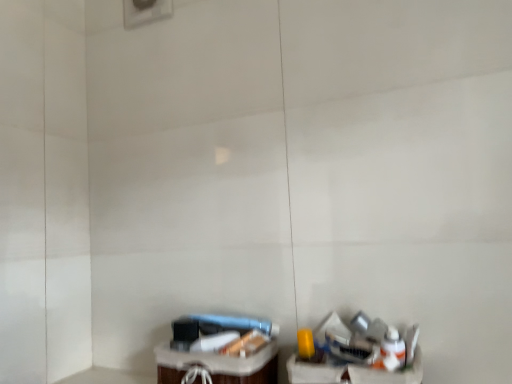
Question: Considering the relative sizes of metallic silver trash can at lower right and translucent plastic basket at lower center in the image provided, is metallic silver trash can at lower right thinner than translucent plastic basket at lower center?

Choices:
 (A) no
 (B) yes

Answer: (B)

Question: Can you confirm if metallic silver trash can at lower right is positioned to the left of translucent plastic basket at lower center?

Choices:
 (A) yes
 (B) no

Answer: (B)

Question: From the image's perspective, is metallic silver trash can at lower right above translucent plastic basket at lower center?

Choices:
 (A) no
 (B) yes

Answer: (B)

Question: Is translucent plastic basket at lower center surrounded by metallic silver trash can at lower right?

Choices:
 (A) no
 (B) yes

Answer: (A)

Question: Is metallic silver trash can at lower right positioned before translucent plastic basket at lower center?

Choices:
 (A) no
 (B) yes

Answer: (B)

Question: Is metallic silver trash can at lower right positioned far away from translucent plastic basket at lower center?

Choices:
 (A) yes
 (B) no

Answer: (B)

Question: Is translucent plastic basket at lower center not close to metallic silver trash can at lower right?

Choices:
 (A) yes
 (B) no

Answer: (B)

Question: From a real-world perspective, does translucent plastic basket at lower center stand above metallic silver trash can at lower right?

Choices:
 (A) yes
 (B) no

Answer: (B)

Question: Is translucent plastic basket at lower center shorter than metallic silver trash can at lower right?

Choices:
 (A) yes
 (B) no

Answer: (A)

Question: Considering the relative positions of translucent plastic basket at lower center and metallic silver trash can at lower right in the image provided, is translucent plastic basket at lower center behind metallic silver trash can at lower right?

Choices:
 (A) yes
 (B) no

Answer: (A)

Question: From a real-world perspective, is translucent plastic basket at lower center below metallic silver trash can at lower right?

Choices:
 (A) yes
 (B) no

Answer: (A)

Question: Does translucent plastic basket at lower center turn towards metallic silver trash can at lower right?

Choices:
 (A) yes
 (B) no

Answer: (B)

Question: Is metallic silver trash can at lower right bigger or smaller than translucent plastic basket at lower center?

Choices:
 (A) big
 (B) small

Answer: (B)